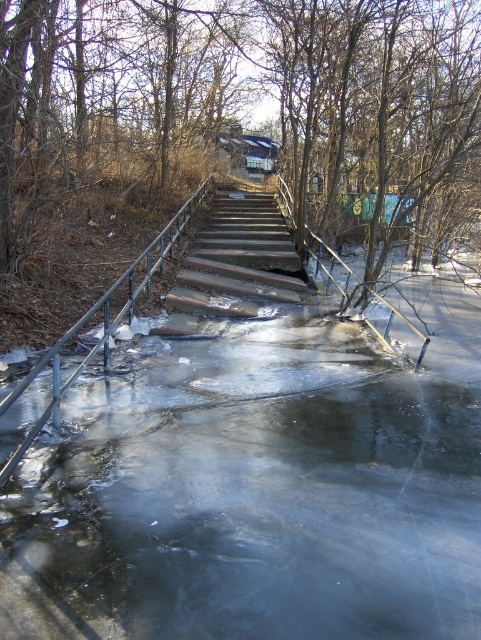
Question: Can you confirm if brown leafless tree at center is positioned to the right of concrete steps at center?

Choices:
 (A) yes
 (B) no

Answer: (A)

Question: Which point is closer to the camera?

Choices:
 (A) (220, 481)
 (B) (299, 212)

Answer: (A)

Question: Estimate the real-world distances between objects in this image. Which object is closer to the brown leafless tree at center?

Choices:
 (A) metal/rusty rail at left
 (B) concrete steps at center

Answer: (B)

Question: Can you confirm if concrete steps at center is positioned to the left of metal/rusty rail at left?

Choices:
 (A) no
 (B) yes

Answer: (A)

Question: Observing the image, what is the correct spatial positioning of brown leafless tree at center in reference to metal/rusty rail at left?

Choices:
 (A) below
 (B) above

Answer: (B)

Question: Among these objects, which one is farthest from the camera?

Choices:
 (A) transparent ice at center
 (B) brown leafless tree at center
 (C) metal/rusty rail at left
 (D) concrete steps at center

Answer: (D)